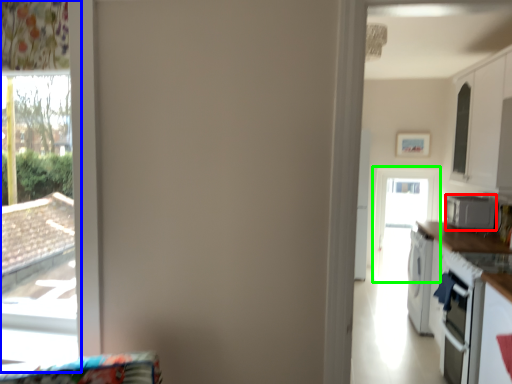
Question: Based on their relative distances, which object is farther from appliance (highlighted by a red box)? Choose from window (highlighted by a blue box) and screen door (highlighted by a green box).

Choices:
 (A) window
 (B) screen door

Answer: (A)